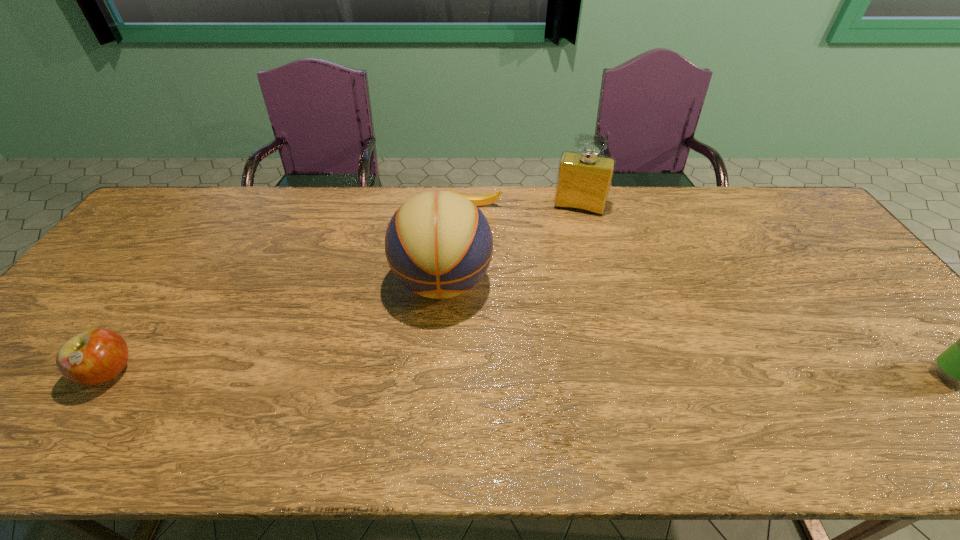
This screenshot has width=960, height=540. I want to click on vacant region located at the stem of the banana, so click(x=479, y=232).

This screenshot has height=540, width=960. Find the location of `vacant space situated at the stem of the banana`. vacant space situated at the stem of the banana is located at coordinates (480, 242).

Locate an element on the screen. The height and width of the screenshot is (540, 960). vacant area situated on the front-facing side of the second object from right to left is located at coordinates (566, 246).

Where is `blank area located on the front-facing side of the second object from right to left`? This screenshot has height=540, width=960. blank area located on the front-facing side of the second object from right to left is located at coordinates (568, 239).

Image resolution: width=960 pixels, height=540 pixels. What are the coordinates of `vacant space situated 0.150m on the front-facing side of the second object from right to left` in the screenshot? It's located at 566,246.

This screenshot has width=960, height=540. I want to click on banana located in the far edge section of the desktop, so click(479, 200).

At what (x,y) coordinates should I click in order to perform the action: click on perfume located at the far edge. Please return your answer as a coordinate pair (x, y). Looking at the image, I should click on (584, 178).

Locate an element on the screen. object located in the near edge section of the desktop is located at coordinates (95, 356).

The width and height of the screenshot is (960, 540). In order to click on object that is at the left edge in this screenshot , I will do `click(95, 356)`.

I want to click on object situated at the near left corner, so click(95, 356).